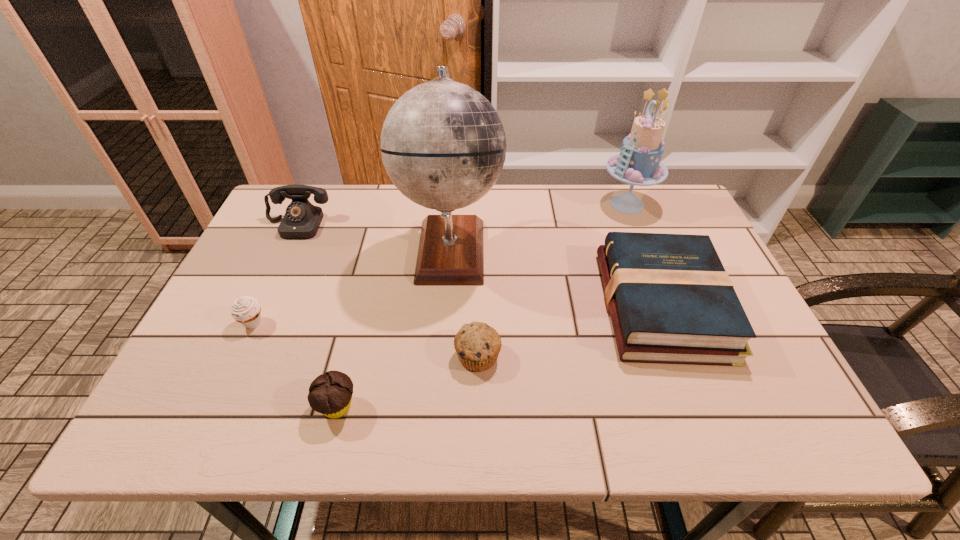
You are a GUI agent. You are given a task and a screenshot of the screen. Output one action in this format:
    pyautogui.click(x=<x>, y=<y>)
    Task: Click on the vacant space at the far left corner of the desktop
    This screenshot has height=540, width=960.
    Given the screenshot: What is the action you would take?
    pyautogui.click(x=322, y=207)

Identify the location of blank area at the near left corner. (175, 423).

Where is `vacant region at the far right corner of the desktop`? This screenshot has width=960, height=540. vacant region at the far right corner of the desktop is located at coordinates (660, 213).

The width and height of the screenshot is (960, 540). What are the coordinates of `free space that is in between the rightmost muffin and the tallest object` in the screenshot? It's located at (465, 302).

Identify the location of free spot between the rightmost muffin and the hardback book. (570, 330).

At what (x,y) coordinates should I click in order to perform the action: click on unoccupied position between the tallest object and the leftmost muffin. Please return your answer as a coordinate pair (x, y). Looking at the image, I should click on (352, 286).

Where is `free space that is in between the sixth shortest object and the third tallest object`? This screenshot has width=960, height=540. free space that is in between the sixth shortest object and the third tallest object is located at coordinates (462, 215).

Where is `vacant space that's between the telephone and the cake`? Image resolution: width=960 pixels, height=540 pixels. vacant space that's between the telephone and the cake is located at coordinates coord(462,215).

The width and height of the screenshot is (960, 540). Identify the location of free spot between the nearest object and the tallest object. (394, 328).

Where is `vacant space in between the telephone and the rightmost muffin`? vacant space in between the telephone and the rightmost muffin is located at coordinates [x=388, y=291].